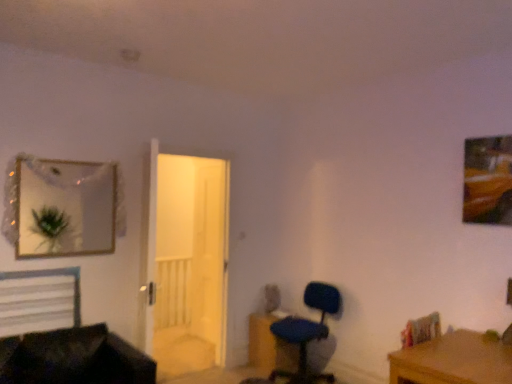
Question: Can you confirm if blue fabric chair at lower right is thinner than black leather couch at lower left?

Choices:
 (A) no
 (B) yes

Answer: (B)

Question: Is blue fabric chair at lower right touching black leather couch at lower left?

Choices:
 (A) yes
 (B) no

Answer: (B)

Question: Is black leather couch at lower left located within blue fabric chair at lower right?

Choices:
 (A) yes
 (B) no

Answer: (B)

Question: Is blue fabric chair at lower right bigger than black leather couch at lower left?

Choices:
 (A) yes
 (B) no

Answer: (B)

Question: Is blue fabric chair at lower right taller than black leather couch at lower left?

Choices:
 (A) no
 (B) yes

Answer: (B)

Question: From a real-world perspective, is white wooden door at center physically located above or below matte silver mirror at upper left?

Choices:
 (A) above
 (B) below

Answer: (B)

Question: Relative to matte silver mirror at upper left, is white wooden door at center in front or behind?

Choices:
 (A) behind
 (B) front

Answer: (A)

Question: In terms of height, does white wooden door at center look taller or shorter compared to matte silver mirror at upper left?

Choices:
 (A) short
 (B) tall

Answer: (B)

Question: Does point (140, 322) appear closer or farther from the camera than point (19, 205)?

Choices:
 (A) closer
 (B) farther

Answer: (B)

Question: In the image, is brown wooden desk at lower right on the left side or the right side of white wooden door at center?

Choices:
 (A) right
 (B) left

Answer: (A)

Question: Considering the positions of point (502, 375) and point (193, 322), is point (502, 375) closer or farther from the camera than point (193, 322)?

Choices:
 (A) closer
 (B) farther

Answer: (A)

Question: Looking at their shapes, would you say brown wooden desk at lower right is wider or thinner than white wooden door at center?

Choices:
 (A) thin
 (B) wide

Answer: (B)

Question: Considering the positions of brown wooden desk at lower right and white wooden door at center in the image, is brown wooden desk at lower right taller or shorter than white wooden door at center?

Choices:
 (A) tall
 (B) short

Answer: (B)

Question: Relative to black leather couch at lower left, is wooden frame at upper right in front or behind?

Choices:
 (A) front
 (B) behind

Answer: (B)

Question: From a real-world perspective, is wooden frame at upper right above or below black leather couch at lower left?

Choices:
 (A) below
 (B) above

Answer: (B)